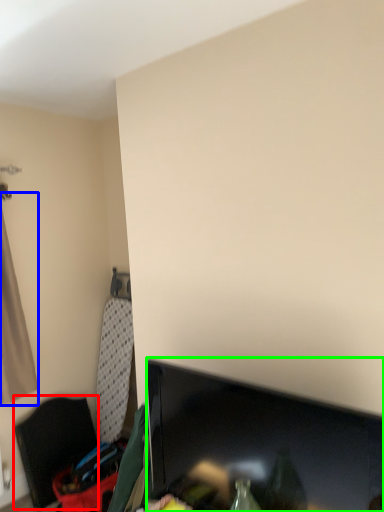
Question: Considering the real-world distances, which object is farthest from furniture (highlighted by a red box)? curtain (highlighted by a blue box) or television (highlighted by a green box)?

Choices:
 (A) curtain
 (B) television

Answer: (B)